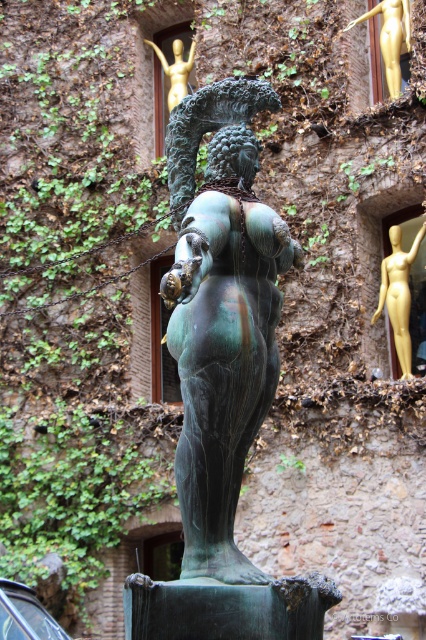
You are an art curator planning to display the bronze statue at center and the gold metallic statue at upper center in a gallery. You need to ensure that the wider statue is placed on the left side of the exhibition wall. Which statue should be placed on the left?

The bronze statue at center should be placed on the left side of the exhibition wall because its width surpasses the gold metallic statue at upper center, making it wider.

You are an art curator planning to display both the bronze statue at center and the gold metallic statue at upper center in a new exhibition. Based on their sizes, which statue should be placed in a more prominent position to emphasize its significance?

The bronze statue at center should be placed in a more prominent position because it is larger in size than the gold metallic statue at upper center, making it visually more dominant and attention grabbing.

You are an art conservator examining the bronze statue. You notice two points on the statue that need restoration. The first point is at coordinates point (230, 540), and the second is at point (399, 237). Which of these points is closer to you?

Point (230, 540) is closer to the viewer than point (399, 237).